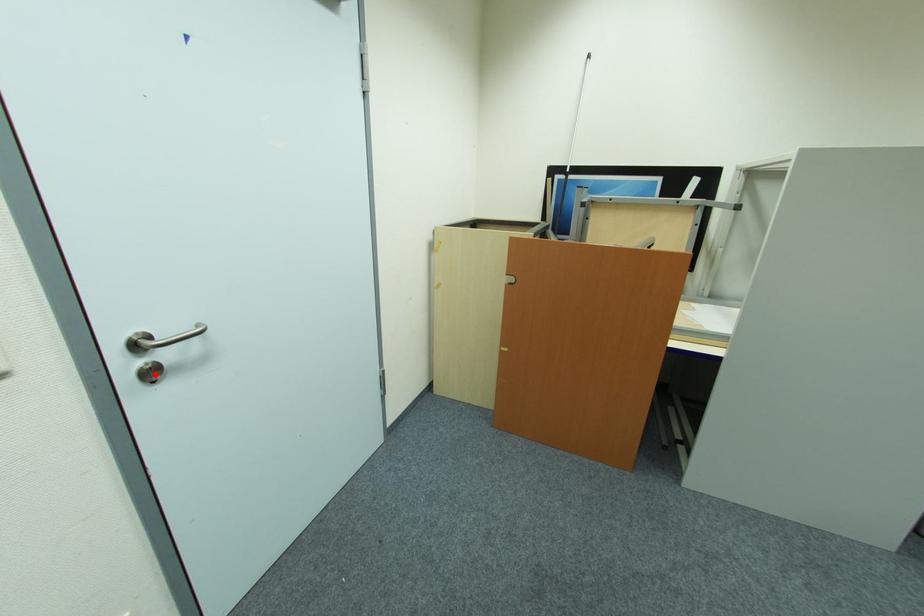
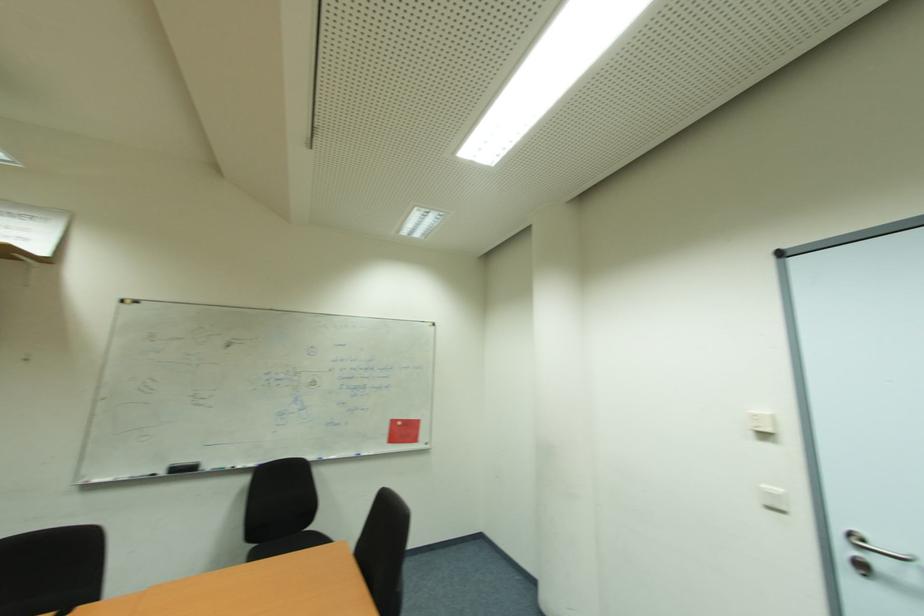
Find the pixel in the second image that matches the highlighted location in the first image.

(869, 570)